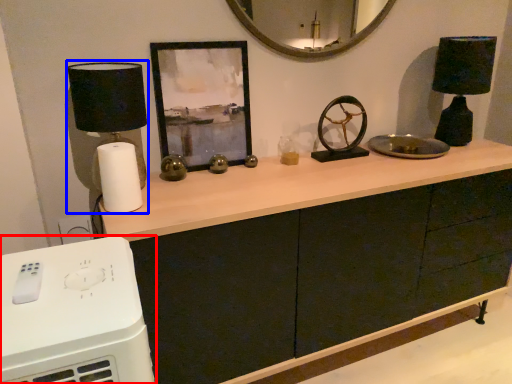
Question: Which object appears farthest to the camera in this image, home appliance (highlighted by a red box) or table lamp (highlighted by a blue box)?

Choices:
 (A) home appliance
 (B) table lamp

Answer: (B)